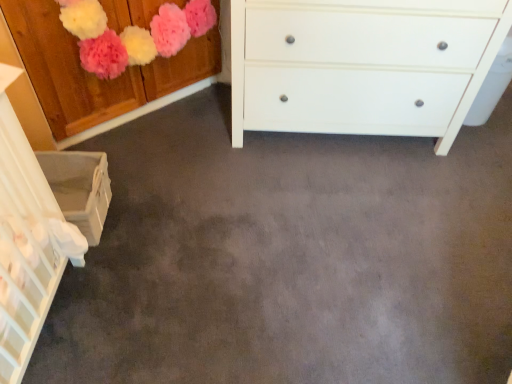
Identify the location of free space between white matte chest of drawers at center and white woven basket at lower left, which is the 2th cabinetry from top to bottom. (216, 167).